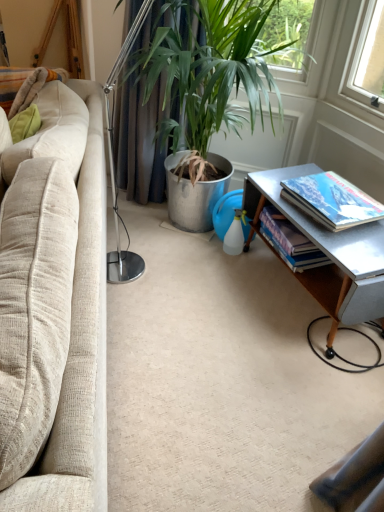
Describe the element at coordinates (92, 283) in the screenshot. Image resolution: width=384 pixels, height=512 pixels. I see `beige fabric couch at left` at that location.

Describe the element at coordinates (290, 241) in the screenshot. This screenshot has width=384, height=512. I see `hardcover book at lower right, which is counted as the first book, starting from the back` at that location.

The height and width of the screenshot is (512, 384). Describe the element at coordinates (332, 200) in the screenshot. I see `hardcover book at right, the second book in the back-to-front sequence` at that location.

What is the approximate width of hardcover book at right, the second book in the back-to-front sequence?

The width of hardcover book at right, the second book in the back-to-front sequence, is 27.63 centimeters.

At what (x,y) coordinates should I click in order to perform the action: click on green fabric curtain at center. Please return your answer as a coordinate pair (x, y). The image size is (384, 512). Looking at the image, I should click on (142, 121).

Looking at the image, does metallic silver table at lower right seem bigger or smaller compared to beige fabric couch at left?

Clearly, metallic silver table at lower right is smaller in size than beige fabric couch at left.

The image size is (384, 512). I want to click on studio couch above the metallic silver table at lower right (from a real-world perspective), so click(92, 283).

In the image, is metallic silver table at lower right on the left side or the right side of beige fabric couch at left?

In the image, metallic silver table at lower right appears on the right side of beige fabric couch at left.

Is the surface of metallic silver table at lower right in direct contact with beige fabric couch at left?

No.

Visually, is green metallic plant pot at center positioned to the left or to the right of beige fabric couch at left?

green metallic plant pot at center is positioned on beige fabric couch at left's right side.

Which is farther, (259, 61) or (73, 317)?

The point (259, 61) is more distant.

How far apart are green metallic plant pot at center and beige fabric couch at left?

green metallic plant pot at center is 20.98 inches from beige fabric couch at left.

Can you confirm if green metallic plant pot at center is bigger than beige fabric couch at left?

Incorrect, green metallic plant pot at center is not larger than beige fabric couch at left.

Considering the sizes of objects hardcover book at right, the second book in the back-to-front sequence, and metallic silver table at lower right in the image provided, who is bigger, hardcover book at right, the second book in the back-to-front sequence, or metallic silver table at lower right?

metallic silver table at lower right is bigger.

From the picture: Considering the sizes of hardcover book at right, which is counted as the 1th book, starting from the front, and metallic silver table at lower right in the image, is hardcover book at right, which is counted as the 1th book, starting from the front, wider or thinner than metallic silver table at lower right?

Considering their sizes, hardcover book at right, which is counted as the 1th book, starting from the front, looks slimmer than metallic silver table at lower right.

From a real-world perspective, is hardcover book at right, which is counted as the 1th book, starting from the front, positioned over metallic silver table at lower right based on gravity?

Yes.

Is hardcover book at right, the second book in the back-to-front sequence, to the left or to the right of metallic silver table at lower right in the image?

Clearly, hardcover book at right, the second book in the back-to-front sequence, is on the right of metallic silver table at lower right in the image.

Does metallic silver table at lower right have a greater width compared to green metallic plant pot at center?

Incorrect, the width of metallic silver table at lower right does not surpass that of green metallic plant pot at center.

Are metallic silver table at lower right and green metallic plant pot at center located far from each other?

No, metallic silver table at lower right is not far away from green metallic plant pot at center.

Does metallic silver table at lower right have a lesser height compared to green metallic plant pot at center?

Indeed, metallic silver table at lower right has a lesser height compared to green metallic plant pot at center.

Considering the points (284, 170) and (268, 3), which point is behind, point (284, 170) or point (268, 3)?

The point (284, 170) is more distant.

Measure the distance between hardcover book at lower right, placed as the second book when sorted from front to back, and metallic silver table at lower right.

hardcover book at lower right, placed as the second book when sorted from front to back, is 12.68 centimeters from metallic silver table at lower right.

Which object is further away from the camera, hardcover book at lower right, placed as the second book when sorted from front to back, or metallic silver table at lower right?

hardcover book at lower right, placed as the second book when sorted from front to back, is further away from the camera.

Is hardcover book at lower right, placed as the second book when sorted from front to back, in contact with metallic silver table at lower right?

No, hardcover book at lower right, placed as the second book when sorted from front to back, is not in contact with metallic silver table at lower right.

Looking at this image, from the image's perspective, which is below, hardcover book at lower right, which is counted as the first book, starting from the back, or metallic silver table at lower right?

metallic silver table at lower right.

Does hardcover book at right, which is counted as the 1th book, starting from the front, have a greater width compared to beige fabric couch at left?

No, hardcover book at right, which is counted as the 1th book, starting from the front, is not wider than beige fabric couch at left.

Is hardcover book at right, the second book in the back-to-front sequence, not close to beige fabric couch at left?

hardcover book at right, the second book in the back-to-front sequence, is near beige fabric couch at left, not far away.

Between hardcover book at right, which is counted as the 1th book, starting from the front, and beige fabric couch at left, which one has more height?

With more height is beige fabric couch at left.

Considering the positions of point (335, 194) and point (61, 428), is point (335, 194) closer or farther from the camera than point (61, 428)?

Clearly, point (335, 194) is more distant from the camera than point (61, 428).

Considering the sizes of metallic silver table at lower right and green fabric curtain at center in the image, is metallic silver table at lower right taller or shorter than green fabric curtain at center?

Clearly, metallic silver table at lower right is shorter compared to green fabric curtain at center.

From a real-world perspective, relative to green fabric curtain at center, is metallic silver table at lower right vertically above or below?

Clearly, from a real-world perspective, metallic silver table at lower right is below green fabric curtain at center.

I want to click on curtain above the metallic silver table at lower right (from the image's perspective), so click(x=142, y=121).

Can you confirm if metallic silver table at lower right is smaller than green fabric curtain at center?

Incorrect, metallic silver table at lower right is not smaller in size than green fabric curtain at center.

Identify the location of table lying on the right of beige fabric couch at left. This screenshot has width=384, height=512. (328, 252).

Find the location of `houseplant above the beige fabric couch at left (from the image's perspective)`. houseplant above the beige fabric couch at left (from the image's perspective) is located at coordinates (207, 73).

Looking at the image, which one is located further to green fabric curtain at center, beige fabric couch at left or hardcover book at lower right, which is counted as the first book, starting from the back?

hardcover book at lower right, which is counted as the first book, starting from the back.

When comparing their distances from hardcover book at lower right, placed as the second book when sorted from front to back, does green metallic plant pot at center or green fabric curtain at center seem further?

green fabric curtain at center lies further to hardcover book at lower right, placed as the second book when sorted from front to back, than the other object.

Looking at the image, which one is located further to hardcover book at lower right, placed as the second book when sorted from front to back, hardcover book at right, the second book in the back-to-front sequence, or beige fabric couch at left?

beige fabric couch at left is further to hardcover book at lower right, placed as the second book when sorted from front to back.

Based on their spatial positions, is green metallic plant pot at center or beige fabric couch at left closer to metallic silver table at lower right?

green metallic plant pot at center lies closer to metallic silver table at lower right than the other object.

Looking at the image, which one is located further to beige fabric couch at left, metallic silver table at lower right or hardcover book at right, which is counted as the 1th book, starting from the front?

hardcover book at right, which is counted as the 1th book, starting from the front.

When comparing their distances from green fabric curtain at center, does green metallic plant pot at center or beige fabric couch at left seem further?

beige fabric couch at left is positioned further to the anchor green fabric curtain at center.

Considering their positions, is hardcover book at lower right, placed as the second book when sorted from front to back, positioned further to hardcover book at right, which is counted as the 1th book, starting from the front, than green fabric curtain at center?

Among the two, green fabric curtain at center is located further to hardcover book at right, which is counted as the 1th book, starting from the front.

Based on their spatial positions, is hardcover book at lower right, which is counted as the first book, starting from the back, or green metallic plant pot at center further from beige fabric couch at left?

hardcover book at lower right, which is counted as the first book, starting from the back.

The image size is (384, 512). What are the coordinates of `book between beige fabric couch at left and hardcover book at lower right, which is counted as the first book, starting from the back, in the front-back direction` in the screenshot? It's located at (332, 200).

The height and width of the screenshot is (512, 384). I want to click on table situated between beige fabric couch at left and hardcover book at right, which is counted as the 1th book, starting from the front, from left to right, so click(328, 252).

At what (x,y) coordinates should I click in order to perform the action: click on houseplant between green fabric curtain at center and hardcover book at lower right, which is counted as the first book, starting from the back, from top to bottom. Please return your answer as a coordinate pair (x, y). This screenshot has height=512, width=384. Looking at the image, I should click on (207, 73).

Locate an element on the screen. The image size is (384, 512). houseplant between beige fabric couch at left and hardcover book at lower right, placed as the second book when sorted from front to back, from front to back is located at coordinates (207, 73).